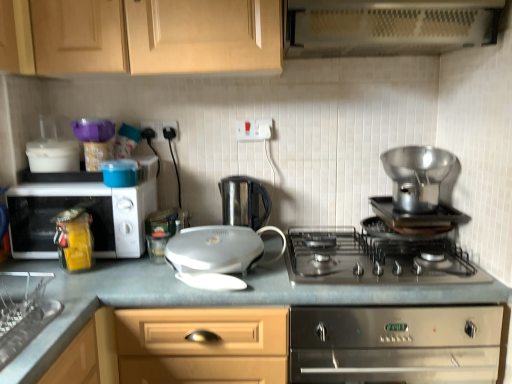
The height and width of the screenshot is (384, 512). I want to click on yellow plastic container at left, so [x=74, y=239].

You are a GUI agent. You are given a task and a screenshot of the screen. Output one action in this format:
    pyautogui.click(x=<x>, y=<y>)
    Task: Click on the white plastic electrical outlet at upper center, the 2th electric outlet from the left
    The image size is (512, 384).
    Given the screenshot: What is the action you would take?
    pyautogui.click(x=254, y=130)

Describe the element at coordinates (244, 201) in the screenshot. I see `satin silver kettle at center, which is counted as the 2th kitchen appliance, starting from the left` at that location.

This screenshot has width=512, height=384. Find the location of `white matte microwave at left`. white matte microwave at left is located at coordinates (87, 211).

At what (x,y) coordinates should I click in order to perform the action: click on shiny metallic pot at right, the third kitchen appliance from the left. Please return your answer as a coordinate pair (x, y). This screenshot has height=384, width=512. Looking at the image, I should click on (417, 176).

Measure the distance between point [426,172] and camera.

The depth of point [426,172] is 5.38 feet.

Locate an element on the screen. Image resolution: width=512 pixels, height=384 pixels. yellow plastic container at left is located at coordinates tap(74, 239).

Does white plastic electrical outlet at upper center, which is the first electric outlet from right to left, have a lesser width compared to white plastic electric outlet at upper center, which is the second electric outlet in right-to-left order?

Incorrect, the width of white plastic electrical outlet at upper center, which is the first electric outlet from right to left, is not less than that of white plastic electric outlet at upper center, which is the second electric outlet in right-to-left order.

Is white plastic electrical outlet at upper center, the 2th electric outlet from the left, facing away from white plastic electric outlet at upper center, which is the first electric outlet in left-to-right order?

No, white plastic electrical outlet at upper center, the 2th electric outlet from the left, is not facing the opposite direction of white plastic electric outlet at upper center, which is the first electric outlet in left-to-right order.

Is white plastic electrical outlet at upper center, which is the first electric outlet from right to left, in contact with white plastic electric outlet at upper center, which is the first electric outlet in left-to-right order?

white plastic electrical outlet at upper center, which is the first electric outlet from right to left, and white plastic electric outlet at upper center, which is the first electric outlet in left-to-right order, are not in contact.

From the image's perspective, is white plastic electric outlet at upper center, which is the second electric outlet in right-to-left order, above or below white glossy sandwich maker at center, which ranks as the 1th kitchen appliance in left-to-right order?

white plastic electric outlet at upper center, which is the second electric outlet in right-to-left order, is above white glossy sandwich maker at center, which ranks as the 1th kitchen appliance in left-to-right order.

Is white plastic electric outlet at upper center, which is the first electric outlet in left-to-right order, facing towards white glossy sandwich maker at center, which ranks as the 1th kitchen appliance in left-to-right order?

No, white plastic electric outlet at upper center, which is the first electric outlet in left-to-right order, is not turned towards white glossy sandwich maker at center, which ranks as the 1th kitchen appliance in left-to-right order.

The width and height of the screenshot is (512, 384). What are the coordinates of `the 1st electric outlet above the white glossy sandwich maker at center, placed as the third kitchen appliance when sorted from right to left (from the image's perspective)` in the screenshot? It's located at (160, 127).

Would you say stainless steel cooker at center is outside yellow plastic container at left?

Yes.

Is point (454, 318) positioned behind point (83, 237)?

That is False.

From a real-world perspective, which object stands above the other?

In real-world perspective, yellow plastic container at left is above.

How different are the orientations of stainless steel cooker at center and yellow plastic container at left in degrees?

The angle between the facing direction of stainless steel cooker at center and the facing direction of yellow plastic container at left is 4.29 degrees.

Could you tell me if white glossy electric grill at center is facing satin silver kettle at center, arranged as the second kitchen appliance when viewed from the right?

No.

Considering the sizes of objects white glossy electric grill at center and satin silver kettle at center, which is counted as the 2th kitchen appliance, starting from the left, in the image provided, who is taller, white glossy electric grill at center or satin silver kettle at center, which is counted as the 2th kitchen appliance, starting from the left,?

Standing taller between the two is white glossy electric grill at center.

From the image's perspective, is white glossy electric grill at center beneath satin silver kettle at center, arranged as the second kitchen appliance when viewed from the right?

Indeed, from the image's perspective, white glossy electric grill at center is shown beneath satin silver kettle at center, arranged as the second kitchen appliance when viewed from the right.

Is white glossy electric grill at center smaller than satin silver kettle at center, arranged as the second kitchen appliance when viewed from the right?

Actually, white glossy electric grill at center might be larger than satin silver kettle at center, arranged as the second kitchen appliance when viewed from the right.

Which of these two, white plastic electrical outlet at upper center, the 2th electric outlet from the left, or stainless steel cooker at center, stands taller?

stainless steel cooker at center.

Is white plastic electrical outlet at upper center, which is the first electric outlet from right to left, completely or partially outside of stainless steel cooker at center?

Yes, white plastic electrical outlet at upper center, which is the first electric outlet from right to left, is outside of stainless steel cooker at center.

How many degrees apart are the facing directions of white plastic electrical outlet at upper center, which is the first electric outlet from right to left, and stainless steel cooker at center?

white plastic electrical outlet at upper center, which is the first electric outlet from right to left, and stainless steel cooker at center are facing 0.153 degrees away from each other.

From a real-world perspective, who is located lower, white plastic electrical outlet at upper center, the 2th electric outlet from the left, or stainless steel cooker at center?

In real-world perspective, stainless steel cooker at center is lower.

From a real-world perspective, does matte wood cabinets at upper center stand above white matte microwave at left?

Indeed, from a real-world perspective, matte wood cabinets at upper center stands above white matte microwave at left.

From the image's perspective, is matte wood cabinets at upper center above white matte microwave at left?

Indeed, from the image's perspective, matte wood cabinets at upper center is shown above white matte microwave at left.

Considering the positions of point (221, 21) and point (18, 215), is point (221, 21) closer or farther from the camera than point (18, 215)?

Point (221, 21).

Is matte wood cabinets at upper center far away from white matte microwave at left?

matte wood cabinets at upper center is near white matte microwave at left, not far away.

From a real-world perspective, which is physically below, white matte microwave at left or white glossy sandwich maker at center, placed as the third kitchen appliance when sorted from right to left?

From a 3D spatial view, white glossy sandwich maker at center, placed as the third kitchen appliance when sorted from right to left, is below.

Does point (32, 217) lie in front of point (212, 252)?

No, (32, 217) is behind (212, 252).

From the image's perspective, relative to white glossy sandwich maker at center, which ranks as the 1th kitchen appliance in left-to-right order, is white matte microwave at left above or below?

From the image's perspective, white matte microwave at left appears above white glossy sandwich maker at center, which ranks as the 1th kitchen appliance in left-to-right order.

Between white matte microwave at left and white glossy sandwich maker at center, which ranks as the 1th kitchen appliance in left-to-right order, which one has less height?

white glossy sandwich maker at center, which ranks as the 1th kitchen appliance in left-to-right order, is shorter.

You are a GUI agent. You are given a task and a screenshot of the screen. Output one action in this format:
    pyautogui.click(x=<x>, y=<y>)
    Task: Click on the electric outlet located on the right of white plastic electric outlet at upper center, which is the first electric outlet in left-to-right order
    Image resolution: width=512 pixels, height=384 pixels.
    Given the screenshot: What is the action you would take?
    pyautogui.click(x=254, y=130)

The width and height of the screenshot is (512, 384). Find the location of `the 2nd electric outlet behind when counting from the white glossy sandwich maker at center, placed as the third kitchen appliance when sorted from right to left`. the 2nd electric outlet behind when counting from the white glossy sandwich maker at center, placed as the third kitchen appliance when sorted from right to left is located at coordinates (160, 127).

Considering their positions, is satin silver kettle at center, which is counted as the 2th kitchen appliance, starting from the left, positioned further to white glossy sandwich maker at center, placed as the third kitchen appliance when sorted from right to left, than white matte microwave at left?

white matte microwave at left lies further to white glossy sandwich maker at center, placed as the third kitchen appliance when sorted from right to left, than the other object.

In the scene shown: From the image, which object appears to be farther from metallic perforated exhaust hood at upper center, stainless steel gas stove at center or white glossy electric grill at center?

Based on the image, white glossy electric grill at center appears to be further to metallic perforated exhaust hood at upper center.

From the image, which object appears to be farther from matte wood cabinets at upper center, white plastic electrical outlet at upper center, which is the first electric outlet from right to left, or shiny metallic pot at right, which appears as the first kitchen appliance when viewed from the right?

shiny metallic pot at right, which appears as the first kitchen appliance when viewed from the right, is positioned further to the anchor matte wood cabinets at upper center.

When comparing their distances from white matte microwave at left, does yellow plastic container at left or stainless steel cooker at center seem closer?

yellow plastic container at left is positioned closer to the anchor white matte microwave at left.

Considering their positions, is stainless steel cooker at center positioned closer to yellow plastic container at left than white plastic electric outlet at upper center, which is the first electric outlet in left-to-right order?

Among the two, white plastic electric outlet at upper center, which is the first electric outlet in left-to-right order, is located nearer to yellow plastic container at left.

Considering their positions, is stainless steel cooker at center positioned closer to matte wood cabinets at upper center than yellow plastic container at left?

Based on the image, yellow plastic container at left appears to be nearer to matte wood cabinets at upper center.

Looking at the image, which one is located further to yellow plastic container at left, white plastic electric outlet at upper center, which is the second electric outlet in right-to-left order, or stainless steel cooker at center?

stainless steel cooker at center.

Which object lies nearer to the anchor point satin silver kettle at center, arranged as the second kitchen appliance when viewed from the right, shiny metallic pot at right, the third kitchen appliance from the left, or white plastic electrical outlet at upper center, the 2th electric outlet from the left?

white plastic electrical outlet at upper center, the 2th electric outlet from the left, is closer to satin silver kettle at center, arranged as the second kitchen appliance when viewed from the right.

The height and width of the screenshot is (384, 512). I want to click on exhaust hood situated between white plastic electrical outlet at upper center, which is the first electric outlet from right to left, and shiny metallic pot at right, the third kitchen appliance from the left, from left to right, so click(387, 26).

Locate an element on the screen. This screenshot has width=512, height=384. electric outlet between white glossy sandwich maker at center, placed as the third kitchen appliance when sorted from right to left, and stainless steel gas stove at center from left to right is located at coordinates (254, 130).

Find the location of a particular element. The height and width of the screenshot is (384, 512). electric outlet between matte wood cabinets at upper center and shiny metallic pot at right, which appears as the first kitchen appliance when viewed from the right, from left to right is located at coordinates (254, 130).

Identify the location of gas stove between white plastic electric outlet at upper center, which is the second electric outlet in right-to-left order, and white glossy electric grill at center in the up-down direction. The height and width of the screenshot is (384, 512). (373, 259).